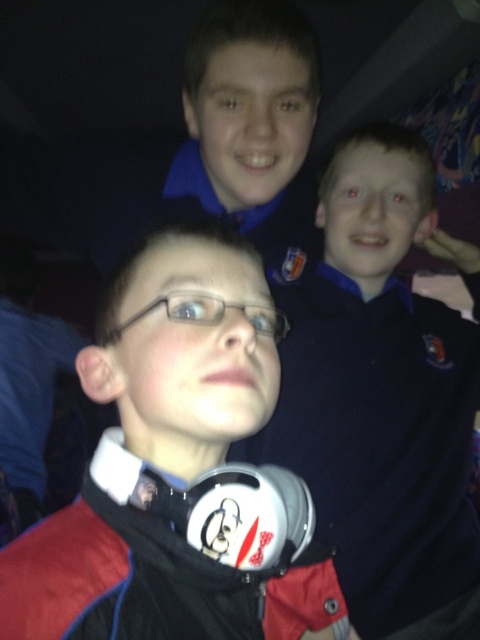
You are trying to organize items on a desk. You have the matte black headphones at center and the transparent plastic glasses at center. Based on their positions, which item is closer to the edge of the desk?

The matte black headphones at center is below the transparent plastic glasses at center, so the headphones are closer to the edge of the desk since they are positioned lower.